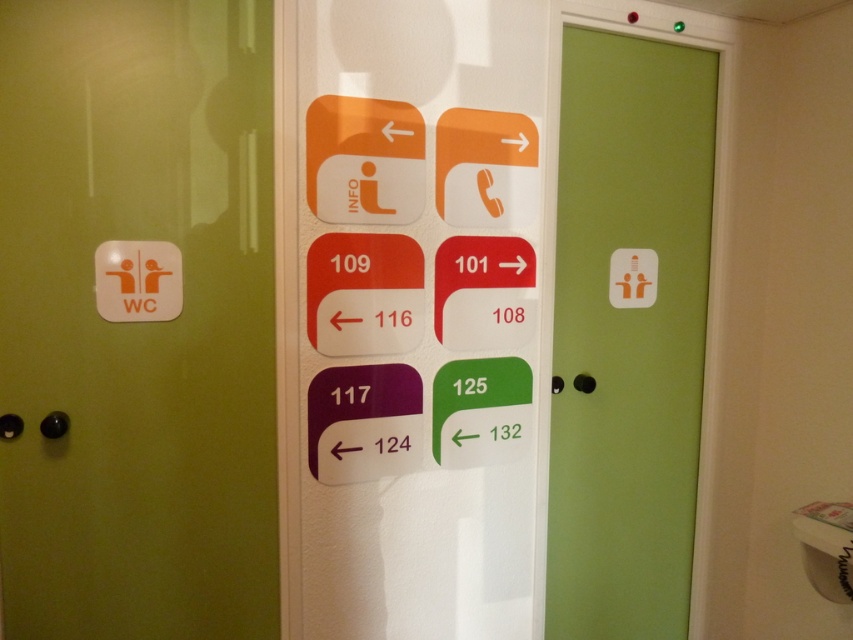
You are standing in front of the wall with the green door and white panel. You need to locate the green matte wc sign at left. According to the coordinates provided, where exactly is it positioned on the wall?

The green matte wc sign at left is positioned at point (136,320) on the wall.

In the scene shown: You are standing in front of the wall with the green matte wc sign at left and the green matte door at center. Which object is taller?

The green matte door at center is taller than the green matte wc sign at left.